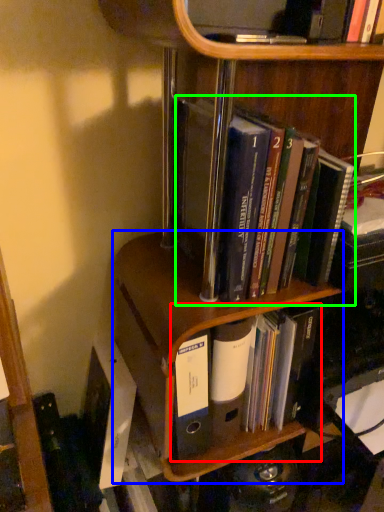
Question: Estimate the real-world distances between objects in this image. Which object is closer to book (highlighted by a red box), shelf (highlighted by a blue box) or book (highlighted by a green box)?

Choices:
 (A) shelf
 (B) book

Answer: (A)